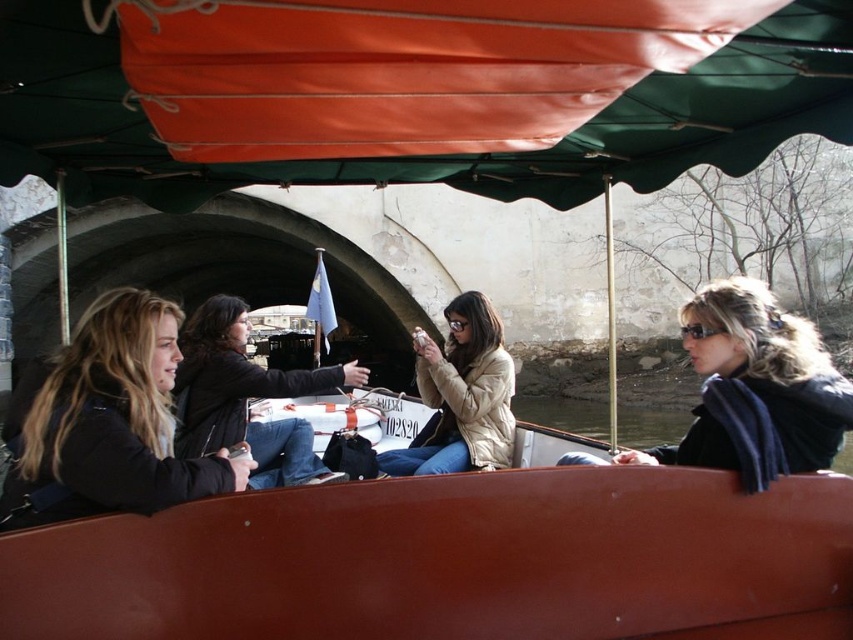
You are standing on a pier and want to take a photo of the smooth brown boat at center. The camera you are using has a maximum focus range of 30 feet. Will you be able to capture the boat clearly?

The smooth brown boat at center is 31.34 feet away from camera, which exceeds the maximum focus range of 30 feet. Therefore, the camera will not be able to focus on the boat clearly.

You are a tour guide standing on the dock. You need to board the smooth brown boat at center and the white fluffy coat at center onto the boat. However, the boat has a maximum weight capacity of 7 meters. Can both items be safely placed on the boat without exceeding its capacity?

The smooth brown boat at center is 6.51 meters away from white fluffy coat at center. Since the boat has a maximum weight capacity of 7 meters, the distance between them does not affect the weight capacity. Both items can be safely placed on the boat as long as their combined weight does not exceed 7 meters. However, the question mentions weight capacity but provides distance information. There might be confusion in the question parameters.

You are standing on the dock and want to reach the point marked by the coordinates point (693,456) on the boat. If your walking speed is 1.5 meters per second, how many seconds will it take you to reach that point?

The distance between you and the point (693,456) is 12.92 meters. At a walking speed of 1.5 meters per second, it will take approximately 8.6 seconds to reach the point.